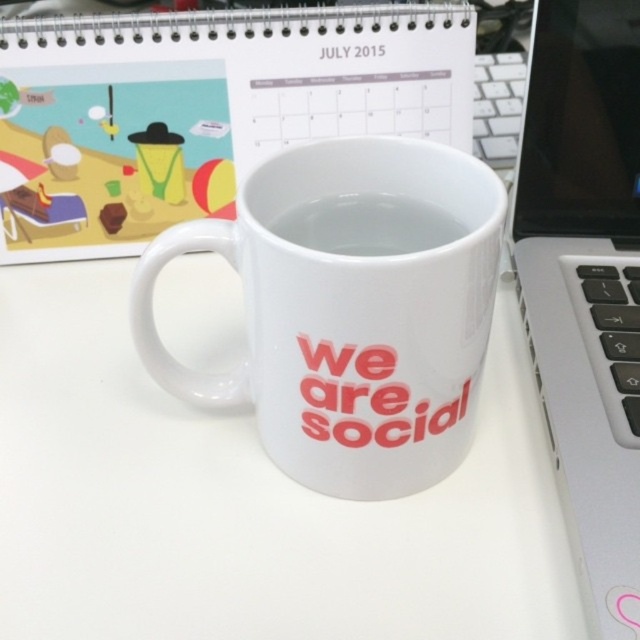
Does white glossy mug at center appear under silver metallic laptop at right?

Yes.

Is white glossy mug at center shorter than silver metallic laptop at right?

Yes, white glossy mug at center is shorter than silver metallic laptop at right.

This screenshot has width=640, height=640. I want to click on white glossy mug at center, so click(x=348, y=317).

Who is higher up, white glossy table at center or silver metallic laptop at right?

silver metallic laptop at right is above.

At what (x,y) coordinates should I click in order to perform the action: click on white glossy table at center. Please return your answer as a coordinate pair (x, y). The height and width of the screenshot is (640, 640). Looking at the image, I should click on (246, 500).

Identify the location of white glossy table at center. (246, 500).

Can you confirm if white glossy mug at center is positioned above transparent glass coffee at center?

Incorrect, white glossy mug at center is not positioned above transparent glass coffee at center.

Can you confirm if white glossy mug at center is positioned to the right of transparent glass coffee at center?

No, white glossy mug at center is not to the right of transparent glass coffee at center.

Does point (470, 252) come closer to viewer compared to point (403, 234)?

Yes.

Identify the location of white glossy mug at center. This screenshot has height=640, width=640. (348, 317).